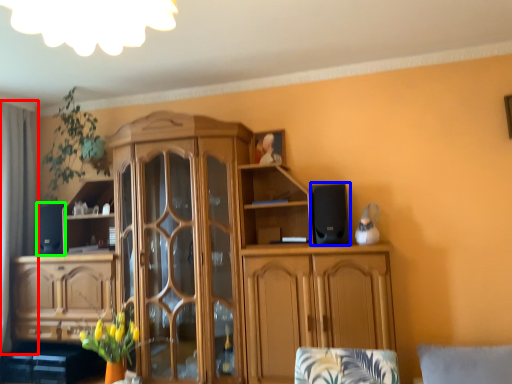
Question: Estimate the real-world distances between objects in this image. Which object is closer to curtain (highlighted by a red box), speaker (highlighted by a blue box) or speaker (highlighted by a green box)?

Choices:
 (A) speaker
 (B) speaker

Answer: (B)